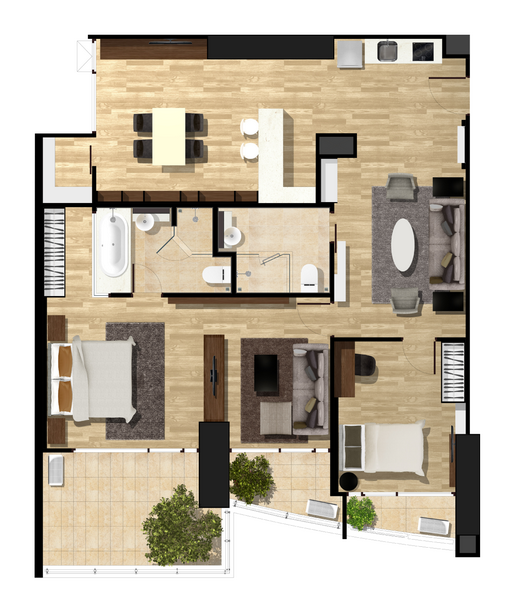
Locate an element on the screen. The width and height of the screenshot is (515, 596). tv is located at coordinates (215, 374).